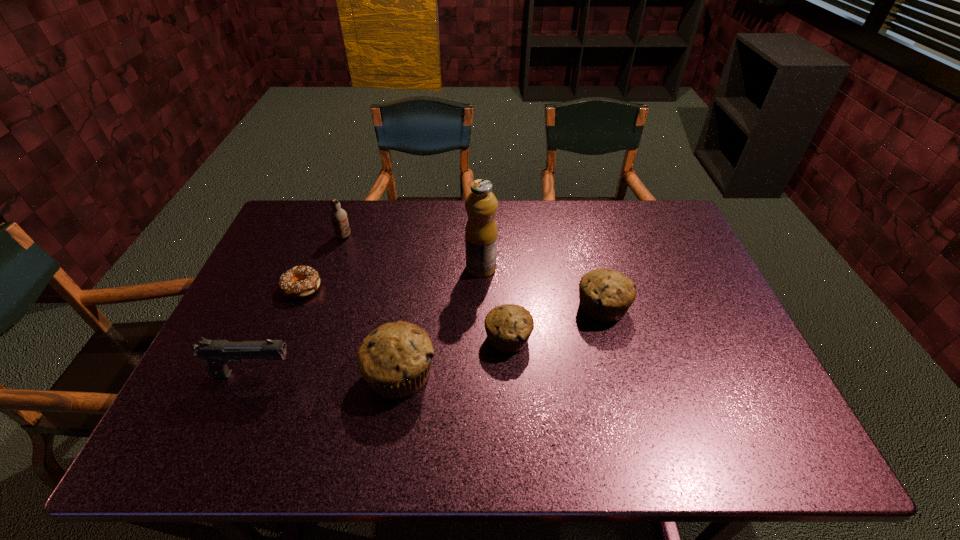
In the current image, all muffins are evenly spaced. To maintain this equal spacing, where should an additional muffin be placed on the right? Please point out a free spot. Please provide its 2D coordinates. Your answer should be formatted as a tuple, i.e. [(x, y)], where the tuple contains the x and y coordinates of a point satisfying the conditions above.

[(685, 279)]